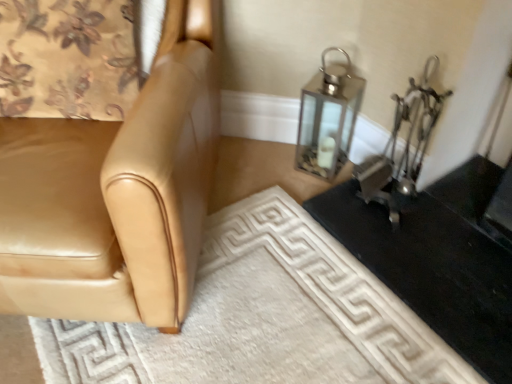
Locate an element on the screen. empty space that is ontop of black glossy table at lower right (from a real-world perspective) is located at coordinates (445, 230).